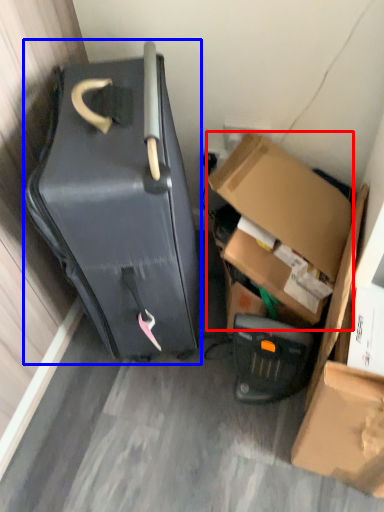
Question: Which point is closer to the camera, box (highlighted by a red box) or suitcase (highlighted by a blue box)?

Choices:
 (A) box
 (B) suitcase

Answer: (B)